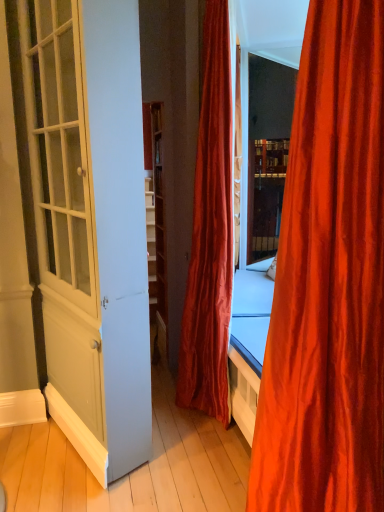
Question: From the image's perspective, is silky orange curtain at right, arranged as the second curtain when viewed from the back, located above velvet red curtain at center, which is the 1th curtain from back to front?

Choices:
 (A) no
 (B) yes

Answer: (A)

Question: Is silky orange curtain at right, the first curtain in the front-to-back sequence, in front of velvet red curtain at center, which appears as the second curtain when viewed from the front?

Choices:
 (A) no
 (B) yes

Answer: (B)

Question: Is silky orange curtain at right, the first curtain in the front-to-back sequence, not inside velvet red curtain at center, which is the 1th curtain from back to front?

Choices:
 (A) no
 (B) yes

Answer: (B)

Question: From the image's perspective, is silky orange curtain at right, arranged as the second curtain when viewed from the back, located beneath velvet red curtain at center, which appears as the second curtain when viewed from the front?

Choices:
 (A) no
 (B) yes

Answer: (B)

Question: Is silky orange curtain at right, arranged as the second curtain when viewed from the back, bigger than velvet red curtain at center, which is the 1th curtain from back to front?

Choices:
 (A) no
 (B) yes

Answer: (A)

Question: From their relative heights in the image, would you say white glossy door at left is taller or shorter than silky orange curtain at right, the first curtain in the front-to-back sequence?

Choices:
 (A) tall
 (B) short

Answer: (A)

Question: Considering their positions, is white glossy door at left located in front of or behind silky orange curtain at right, the first curtain in the front-to-back sequence?

Choices:
 (A) front
 (B) behind

Answer: (B)

Question: From a real-world perspective, is white glossy door at left positioned above or below silky orange curtain at right, arranged as the second curtain when viewed from the back?

Choices:
 (A) above
 (B) below

Answer: (A)

Question: Choose the correct answer: Is white glossy door at left inside silky orange curtain at right, arranged as the second curtain when viewed from the back, or outside it?

Choices:
 (A) outside
 (B) inside

Answer: (A)

Question: From a real-world perspective, is silky orange curtain at right, arranged as the second curtain when viewed from the back, positioned above or below white glossy door at left?

Choices:
 (A) above
 (B) below

Answer: (B)

Question: Looking at the image, does silky orange curtain at right, the first curtain in the front-to-back sequence, seem bigger or smaller compared to white glossy door at left?

Choices:
 (A) big
 (B) small

Answer: (B)

Question: Is silky orange curtain at right, the first curtain in the front-to-back sequence, inside the boundaries of white glossy door at left, or outside?

Choices:
 (A) outside
 (B) inside

Answer: (A)

Question: Considering the positions of point pyautogui.click(x=269, y=465) and point pyautogui.click(x=51, y=96), is point pyautogui.click(x=269, y=465) closer or farther from the camera than point pyautogui.click(x=51, y=96)?

Choices:
 (A) closer
 (B) farther

Answer: (A)

Question: From the image's perspective, relative to velvet red curtain at center, which is the 1th curtain from back to front, is white glossy door at left above or below?

Choices:
 (A) below
 (B) above

Answer: (A)

Question: Is point (57, 211) positioned closer to the camera than point (208, 348)?

Choices:
 (A) closer
 (B) farther

Answer: (A)